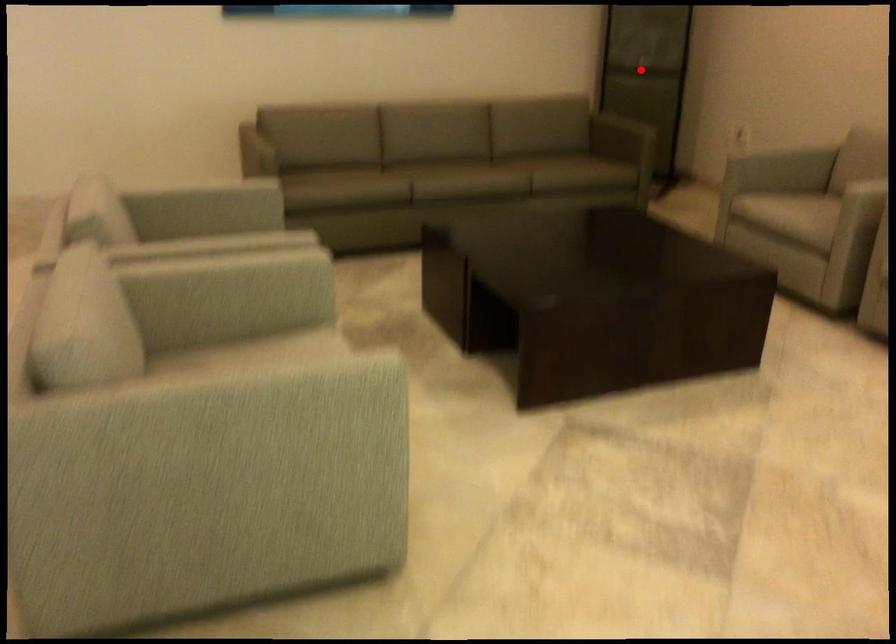
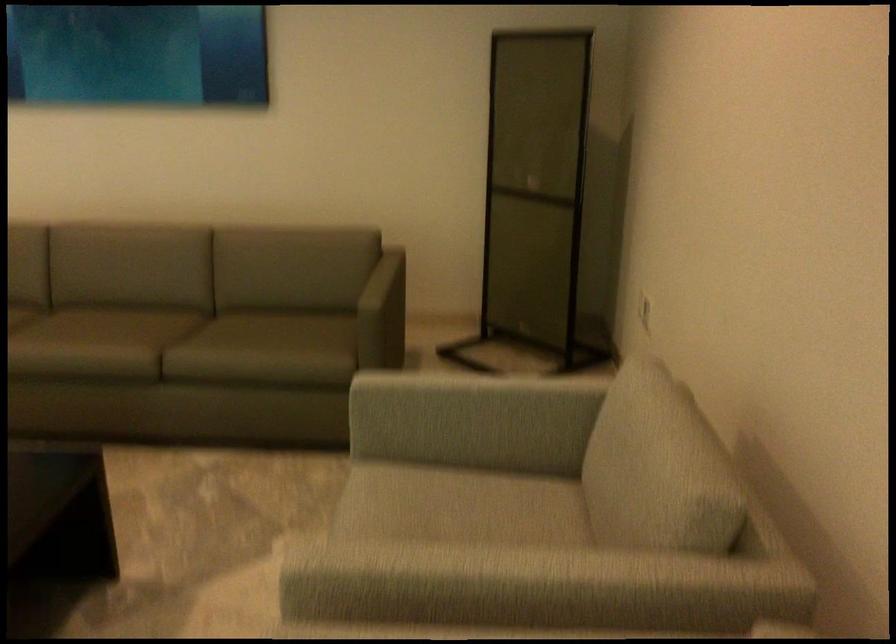
Where in the second image is the point corresponding to the highlighted location from the first image?

(536, 194)